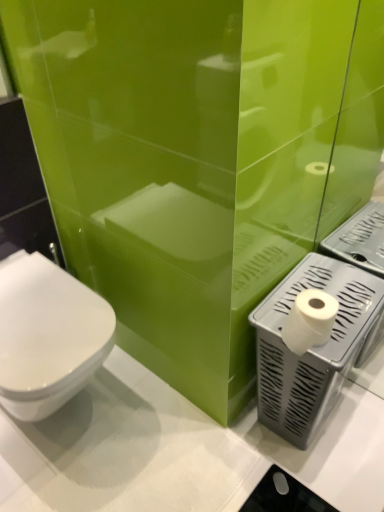
Question: Is gray plastic toilet paper holder at lower right wider than white glossy toilet at left?

Choices:
 (A) no
 (B) yes

Answer: (A)

Question: Is gray plastic toilet paper holder at lower right next to white glossy toilet at left and touching it?

Choices:
 (A) no
 (B) yes

Answer: (A)

Question: Considering the relative sizes of gray plastic toilet paper holder at lower right and white glossy toilet at left in the image provided, is gray plastic toilet paper holder at lower right shorter than white glossy toilet at left?

Choices:
 (A) yes
 (B) no

Answer: (B)

Question: Can you confirm if gray plastic toilet paper holder at lower right is positioned to the left of white glossy toilet at left?

Choices:
 (A) yes
 (B) no

Answer: (B)

Question: Is gray plastic toilet paper holder at lower right far from white glossy toilet at left?

Choices:
 (A) yes
 (B) no

Answer: (B)

Question: Is gray plastic toilet paper holder at lower right situated inside white matte toilet paper at right or outside?

Choices:
 (A) outside
 (B) inside

Answer: (A)

Question: Based on their positions, is gray plastic toilet paper holder at lower right located to the left or right of white matte toilet paper at right?

Choices:
 (A) right
 (B) left

Answer: (A)

Question: From their relative heights in the image, would you say gray plastic toilet paper holder at lower right is taller or shorter than white matte toilet paper at right?

Choices:
 (A) short
 (B) tall

Answer: (B)

Question: From a real-world perspective, is gray plastic toilet paper holder at lower right above or below white matte toilet paper at right?

Choices:
 (A) below
 (B) above

Answer: (A)

Question: Is point (344, 343) positioned closer to the camera than point (96, 348)?

Choices:
 (A) closer
 (B) farther

Answer: (A)

Question: Is gray plastic toilet paper holder at lower right in front of or behind white glossy toilet at left in the image?

Choices:
 (A) front
 (B) behind

Answer: (B)

Question: Choose the correct answer: Is gray plastic toilet paper holder at lower right inside white glossy toilet at left or outside it?

Choices:
 (A) outside
 (B) inside

Answer: (A)

Question: Based on their positions, is gray plastic toilet paper holder at lower right located to the left or right of white glossy toilet at left?

Choices:
 (A) left
 (B) right

Answer: (B)

Question: From the image's perspective, is white glossy toilet at left positioned above or below white matte toilet paper at right?

Choices:
 (A) above
 (B) below

Answer: (B)

Question: Would you say white glossy toilet at left is inside or outside white matte toilet paper at right?

Choices:
 (A) inside
 (B) outside

Answer: (B)